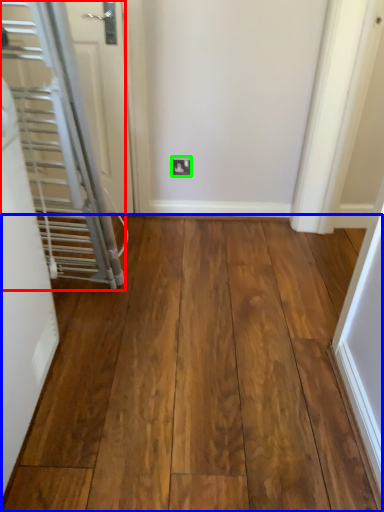
Question: Considering the real-world distances, which object is closest to door (highlighted by a red box)? hardwood (highlighted by a blue box) or electric outlet (highlighted by a green box).

Choices:
 (A) hardwood
 (B) electric outlet

Answer: (A)